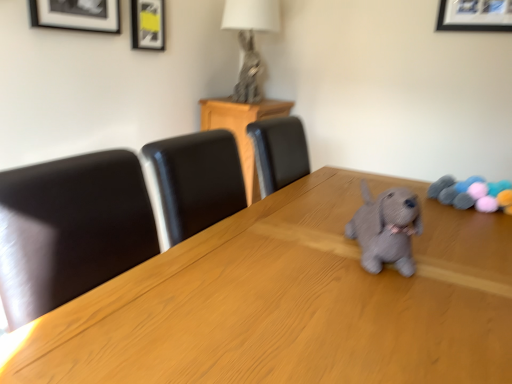
Locate an element on the screen. free location to the left of gray knitted dog at center is located at coordinates (290, 250).